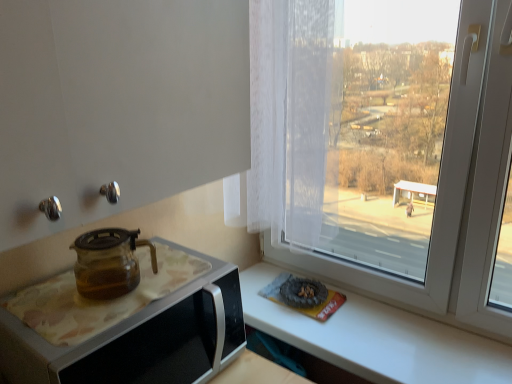
Question: From a real-world perspective, is transparent glass teapot at left located higher than transparent glass teapot at left?

Choices:
 (A) yes
 (B) no

Answer: (B)

Question: Does transparent glass teapot at left lie behind transparent glass teapot at left?

Choices:
 (A) yes
 (B) no

Answer: (B)

Question: Does transparent glass teapot at left have a greater height compared to transparent glass teapot at left?

Choices:
 (A) no
 (B) yes

Answer: (B)

Question: Is transparent glass teapot at left thinner than transparent glass teapot at left?

Choices:
 (A) no
 (B) yes

Answer: (A)

Question: Considering the relative sizes of transparent glass teapot at left and transparent glass teapot at left in the image provided, is transparent glass teapot at left shorter than transparent glass teapot at left?

Choices:
 (A) no
 (B) yes

Answer: (A)

Question: Are transparent glass teapot at left and transparent glass teapot at left making contact?

Choices:
 (A) yes
 (B) no

Answer: (B)

Question: From the image's perspective, is transparent glass teapot at left on top of transparent glass teapot at left?

Choices:
 (A) yes
 (B) no

Answer: (A)

Question: Does transparent glass teapot at left touch transparent glass teapot at left?

Choices:
 (A) no
 (B) yes

Answer: (A)

Question: Can you confirm if transparent glass teapot at left is bigger than transparent glass teapot at left?

Choices:
 (A) yes
 (B) no

Answer: (B)

Question: Is transparent glass teapot at left positioned with its back to transparent glass teapot at left?

Choices:
 (A) yes
 (B) no

Answer: (B)

Question: From a real-world perspective, does transparent glass teapot at left stand above transparent glass teapot at left?

Choices:
 (A) no
 (B) yes

Answer: (B)

Question: Does transparent glass teapot at left come behind transparent glass teapot at left?

Choices:
 (A) no
 (B) yes

Answer: (B)

Question: From a real-world perspective, is transparent glass teapot at left above or below transparent glass teapot at left?

Choices:
 (A) above
 (B) below

Answer: (B)